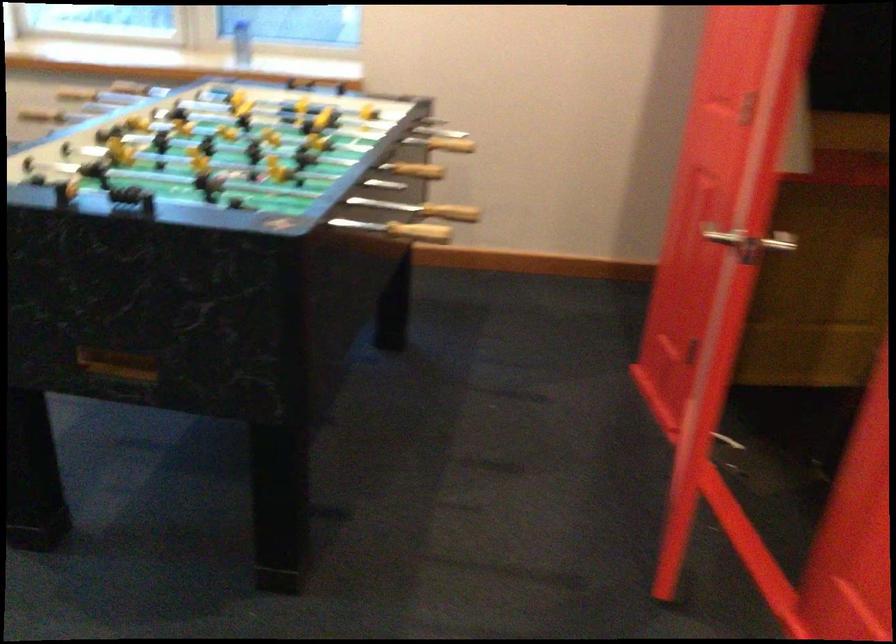
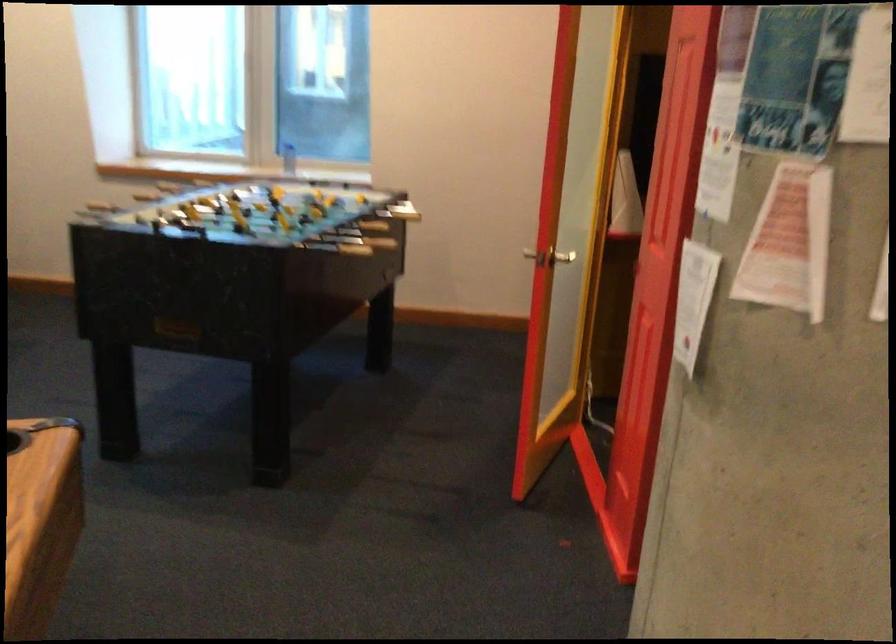
In the second image, find the point that corresponds to point (156, 147) in the first image.

(213, 210)